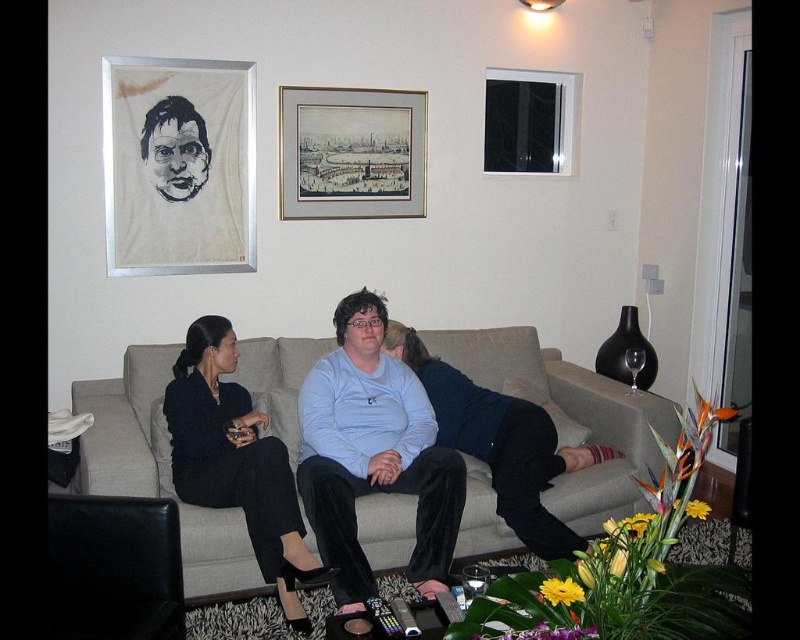
From the picture: Is silver metallic picture frame at upper left thinner than light blue sweater at center?

Indeed, silver metallic picture frame at upper left has a lesser width compared to light blue sweater at center.

What do you see at coordinates (178, 164) in the screenshot? Image resolution: width=800 pixels, height=640 pixels. I see `silver metallic picture frame at upper left` at bounding box center [178, 164].

Image resolution: width=800 pixels, height=640 pixels. In order to click on silver metallic picture frame at upper left in this screenshot , I will do `click(178, 164)`.

Is point (202, 179) less distant than point (285, 512)?

That is False.

Is silver metallic picture frame at upper left thinner than black fabric dress at center?

Yes.

This screenshot has width=800, height=640. I want to click on silver metallic picture frame at upper left, so click(178, 164).

Which is behind, point (266, 337) or point (156, 163)?

The point (266, 337) is more distant.

Does light gray fabric couch at center appear on the right side of silver metallic picture frame at upper left?

Yes, light gray fabric couch at center is to the right of silver metallic picture frame at upper left.

Which is behind, point (289, 339) or point (156, 141)?

The point (156, 141) is behind.

Identify the location of light gray fabric couch at center. pyautogui.click(x=570, y=417).